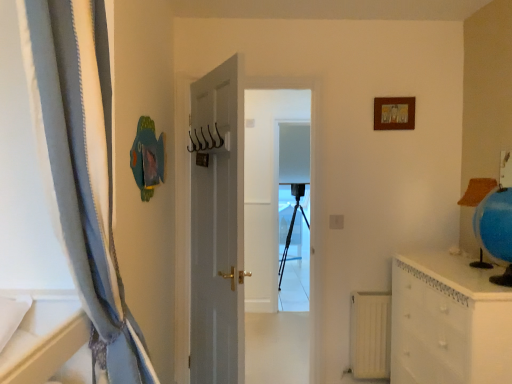
Where is `vacant area on top of white glossy door at center (from a real-world perspective)`? vacant area on top of white glossy door at center (from a real-world perspective) is located at coordinates (269, 65).